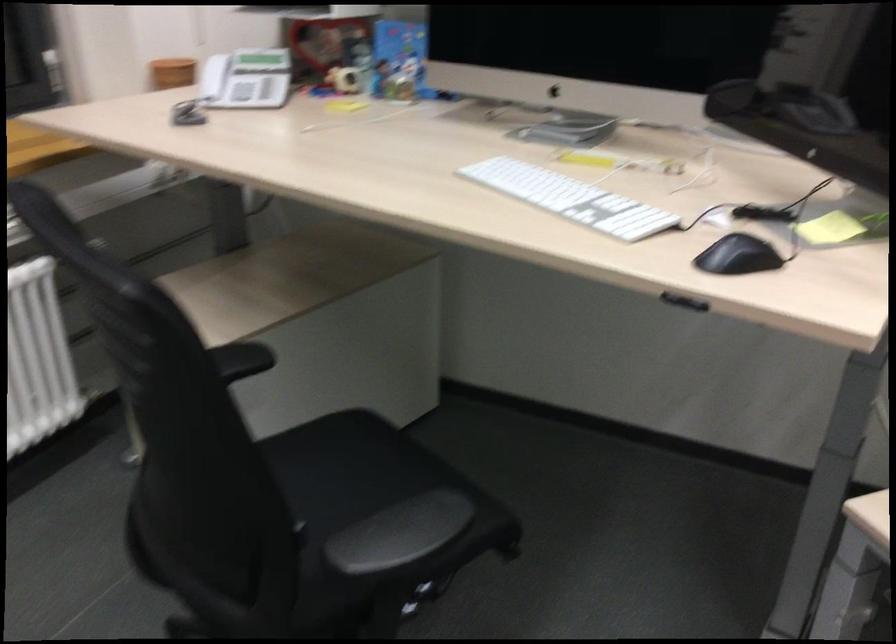
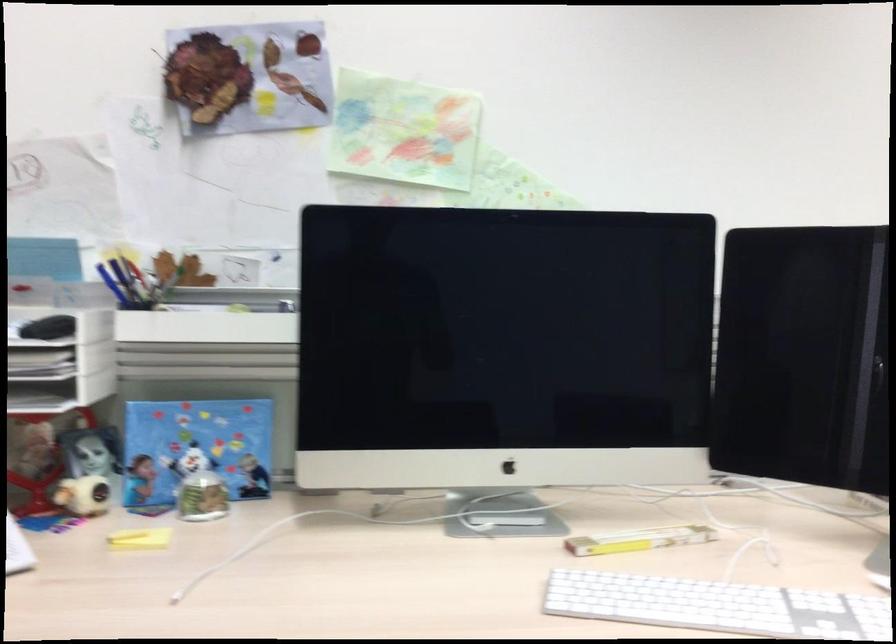
The point at (555,116) is marked in the first image. Where is the corresponding point in the second image?

(449, 494)